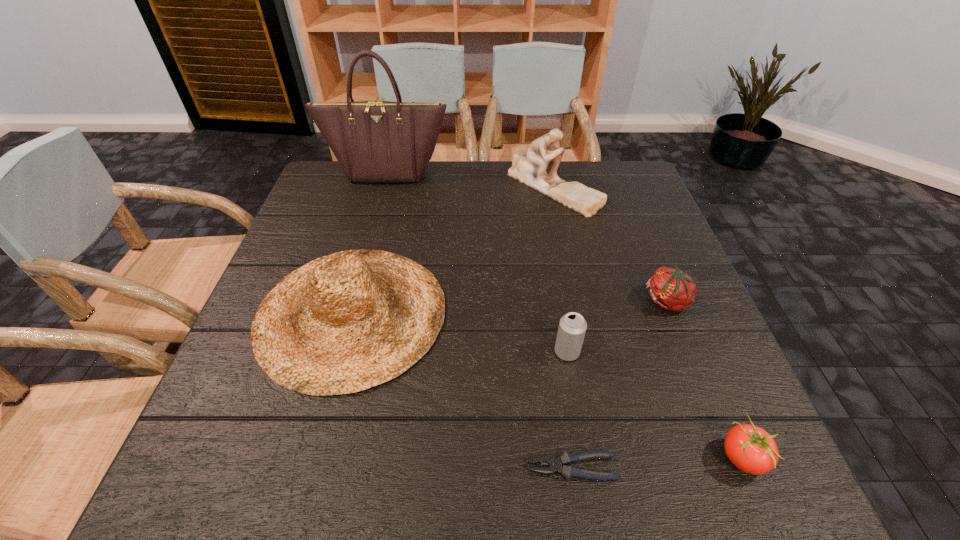
Identify the location of object that is the fifth closest to the figurine. The height and width of the screenshot is (540, 960). 751,449.

Identify which object is the nearest to the fifth shortest object. Please provide its 2D coordinates. Your answer should be formatted as a tuple, i.e. [(x, y)], where the tuple contains the x and y coordinates of a point satisfying the conditions above.

[(568, 472)]

At what (x,y) coordinates should I click in order to perform the action: click on vacant area that satisfies the following two spatial constraints: 1. on the front-facing side of the sixth shortest object; 2. on the left side of the nearer tomato. Please return your answer as a coordinate pair (x, y). The image size is (960, 540). Looking at the image, I should click on (610, 457).

This screenshot has height=540, width=960. What are the coordinates of `vacant point that satisfies the following two spatial constraints: 1. on the front side of the fourth tallest object; 2. at the gripping part of the pliers` in the screenshot? It's located at (587, 468).

Find the location of `free space that satisfies the following two spatial constraints: 1. on the front side of the farther tomato; 2. at the gripping part of the pliers`. free space that satisfies the following two spatial constraints: 1. on the front side of the farther tomato; 2. at the gripping part of the pliers is located at coordinates (734, 468).

The height and width of the screenshot is (540, 960). Identify the location of vacant space that satisfies the following two spatial constraints: 1. on the front-facing side of the tallest object; 2. on the right side of the farther tomato. (351, 301).

You are a GUI agent. You are given a task and a screenshot of the screen. Output one action in this format:
    pyautogui.click(x=<x>, y=<y>)
    Task: Click on the free region that satisfies the following two spatial constraints: 1. on the back side of the farther tomato; 2. on the right side of the sunhat
    
    Given the screenshot: What is the action you would take?
    pyautogui.click(x=355, y=301)